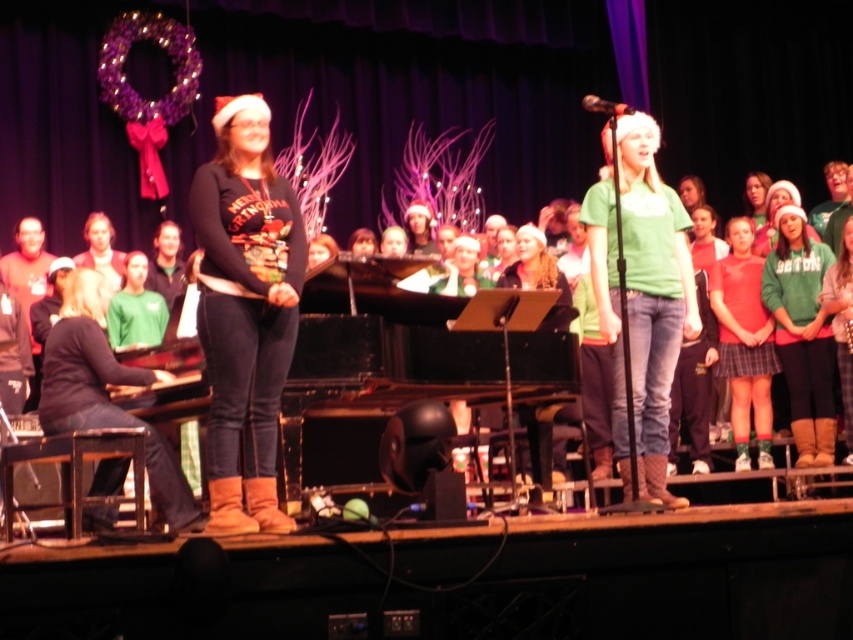
Question: Which point is farther to the camera?

Choices:
 (A) green matte shirt at center
 (B) matte black sweater at center

Answer: (A)

Question: Which of the following is the closest to the observer?

Choices:
 (A) (627, 168)
 (B) (289, 192)

Answer: (B)

Question: Can you confirm if matte black sweater at center is positioned above green matte shirt at center?

Choices:
 (A) no
 (B) yes

Answer: (A)

Question: Does matte black sweater at center have a lesser width compared to green matte shirt at center?

Choices:
 (A) yes
 (B) no

Answer: (A)

Question: Does matte black sweater at center appear on the left side of green matte shirt at center?

Choices:
 (A) no
 (B) yes

Answer: (B)

Question: Among these objects, which one is farthest from the camera?

Choices:
 (A) matte black sweater at center
 (B) green matte shirt at center

Answer: (B)